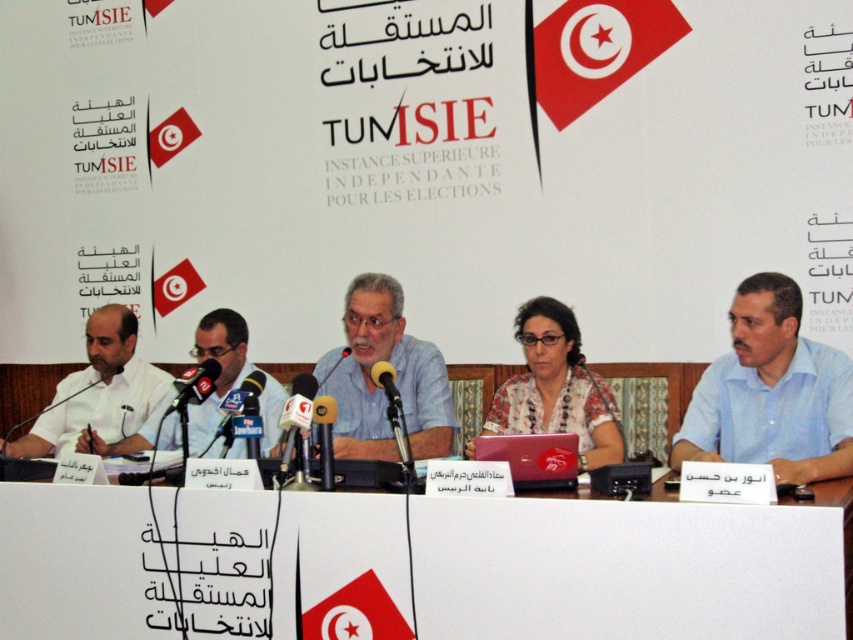
You are attending the press conference and want to introduce the person wearing the gray fabric shirt at center. Which side of the black plastic microphone at left should you look to find them?

The gray fabric shirt at center is to the right of the black plastic microphone at left, so look to the right side of the black plastic microphone at left to find the person wearing the gray fabric shirt at center.